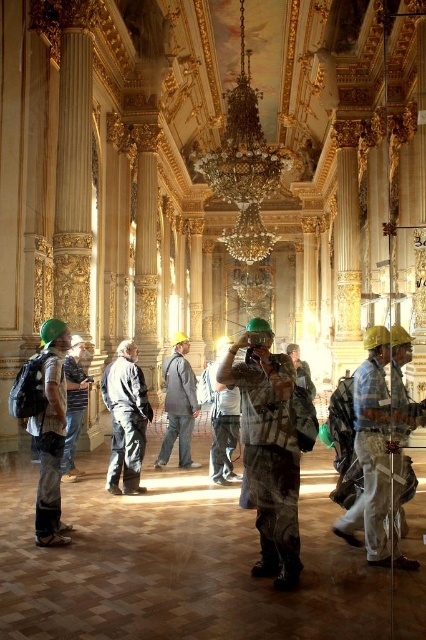
You are standing in the grand ornate interior and need to locate both the camouflage shirt at center and the gray fabric jacket at center. If you face the room, which one is on your right side?

The camouflage shirt at center is to the right of the gray fabric jacket at center, so when facing the room, the camouflage shirt at center will be on your right side.